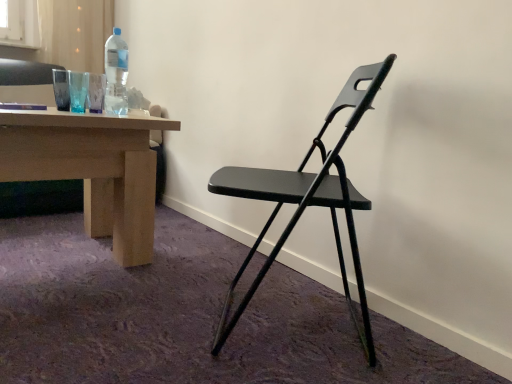
Locate an element on the screen. vacant region to the left of matte black folding chair at center is located at coordinates (122, 317).